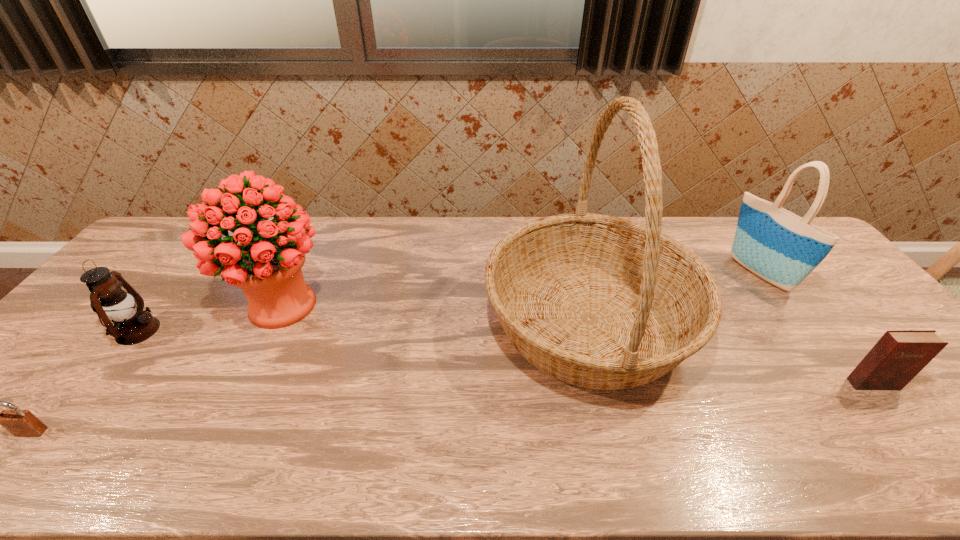
The width and height of the screenshot is (960, 540). What are the coordinates of `the tallest object` in the screenshot? It's located at (601, 302).

At what (x,y) coordinates should I click in order to perform the action: click on the third object from right to left. Please return your answer as a coordinate pair (x, y). Image resolution: width=960 pixels, height=540 pixels. Looking at the image, I should click on (601, 302).

Where is `the third object from left to right`? the third object from left to right is located at coordinates (266, 264).

At what (x,y) coordinates should I click in order to perform the action: click on tote bag. Please return your answer as a coordinate pair (x, y). Image resolution: width=960 pixels, height=540 pixels. Looking at the image, I should click on (782, 248).

Where is `the fourth tallest object`? This screenshot has width=960, height=540. the fourth tallest object is located at coordinates point(132,325).

Locate an element on the screen. This screenshot has width=960, height=540. diary is located at coordinates (899, 355).

Where is `the nearest object`? The image size is (960, 540). the nearest object is located at coordinates (21, 423).

Identify the location of padlock. The height and width of the screenshot is (540, 960). (21, 423).

The height and width of the screenshot is (540, 960). I want to click on vacant space situated 0.170m on the right of the fourth object from left to right, so click(x=755, y=321).

The image size is (960, 540). Find the location of `blank area located 0.280m on the front of the third object from left to right`. blank area located 0.280m on the front of the third object from left to right is located at coordinates (215, 444).